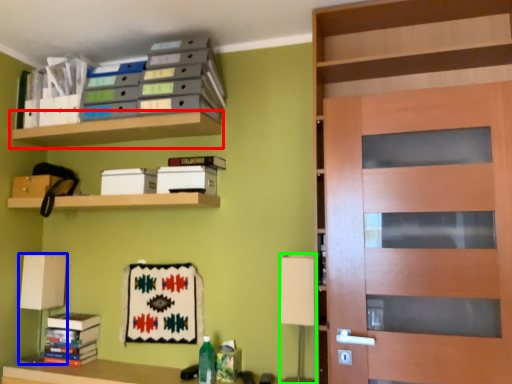
Question: Based on their relative distances, which object is nearer to shelf (highlighted by a red box)? Choose from table lamp (highlighted by a blue box) and table lamp (highlighted by a green box).

Choices:
 (A) table lamp
 (B) table lamp

Answer: (A)